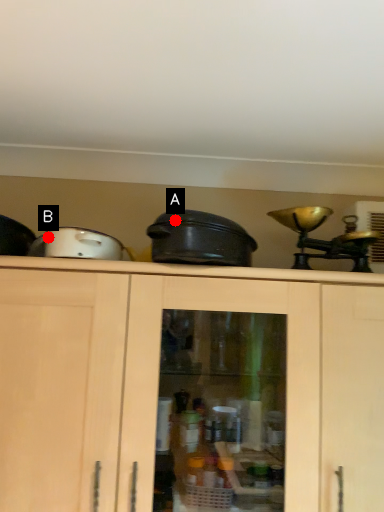
Question: Two points are circled on the image, labeled by A and B beside each circle. Which point is farther to the camera?

Choices:
 (A) A is further
 (B) B is further

Answer: (B)